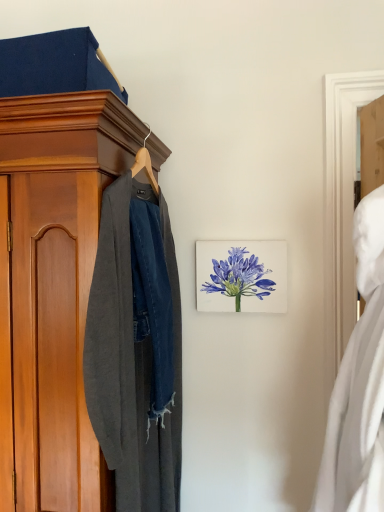
Question: Can you confirm if white matte dress at right is shorter than dark gray wool coat at left?

Choices:
 (A) yes
 (B) no

Answer: (A)

Question: From the image's perspective, is white matte dress at right above dark gray wool coat at left?

Choices:
 (A) no
 (B) yes

Answer: (B)

Question: Is white matte dress at right in front of dark gray wool coat at left?

Choices:
 (A) no
 (B) yes

Answer: (B)

Question: Can you confirm if white matte dress at right is thinner than dark gray wool coat at left?

Choices:
 (A) yes
 (B) no

Answer: (B)

Question: Could you tell me if white matte dress at right is facing dark gray wool coat at left?

Choices:
 (A) no
 (B) yes

Answer: (B)

Question: Looking at their shapes, would you say white matte dress at right is wider or thinner than watercolor blue flower at center?

Choices:
 (A) thin
 (B) wide

Answer: (B)

Question: Is white matte dress at right bigger or smaller than watercolor blue flower at center?

Choices:
 (A) small
 (B) big

Answer: (B)

Question: From the image's perspective, is white matte dress at right located above or below watercolor blue flower at center?

Choices:
 (A) below
 (B) above

Answer: (A)

Question: In terms of height, does white matte dress at right look taller or shorter compared to watercolor blue flower at center?

Choices:
 (A) tall
 (B) short

Answer: (A)

Question: Is dark gray wool coat at left inside the boundaries of watercolor blue flower at center, or outside?

Choices:
 (A) outside
 (B) inside

Answer: (A)

Question: Looking at their shapes, would you say dark gray wool coat at left is wider or thinner than watercolor blue flower at center?

Choices:
 (A) thin
 (B) wide

Answer: (B)

Question: Considering the positions of dark gray wool coat at left and watercolor blue flower at center in the image, is dark gray wool coat at left taller or shorter than watercolor blue flower at center?

Choices:
 (A) short
 (B) tall

Answer: (B)

Question: In the image, is dark gray wool coat at left positioned in front of or behind watercolor blue flower at center?

Choices:
 (A) behind
 (B) front

Answer: (B)

Question: Based on their sizes in the image, would you say watercolor blue flower at center is bigger or smaller than dark gray wool coat at left?

Choices:
 (A) big
 (B) small

Answer: (B)

Question: In terms of height, does watercolor blue flower at center look taller or shorter compared to dark gray wool coat at left?

Choices:
 (A) short
 (B) tall

Answer: (A)